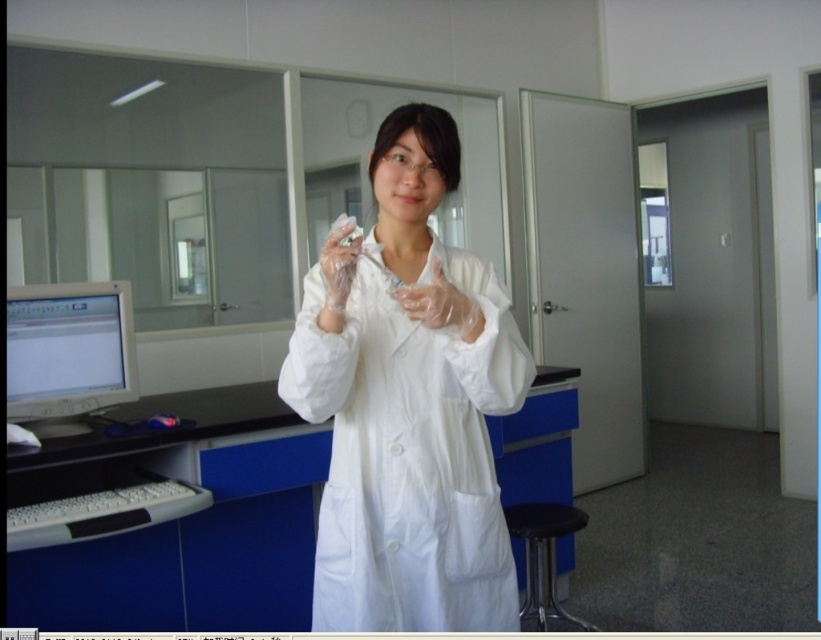
Question: Which point is closer to the camera taking this photo?

Choices:
 (A) (549, 561)
 (B) (324, 339)
 (C) (433, 282)

Answer: (B)

Question: Can you confirm if white lab coat at center is positioned to the left of clear plastic glove at center?

Choices:
 (A) yes
 (B) no

Answer: (A)

Question: Which point is closer to the camera?

Choices:
 (A) clear plastic glove at center
 (B) matte gray monitor at left
 (C) black plastic stool at lower right
 (D) white lab coat at center

Answer: (D)

Question: Can you confirm if white lab coat at center is smaller than black plastic stool at lower right?

Choices:
 (A) no
 (B) yes

Answer: (A)

Question: Does matte gray monitor at left have a lesser width compared to clear plastic glove at center?

Choices:
 (A) yes
 (B) no

Answer: (B)

Question: Which is farther from the white lab coat at center?

Choices:
 (A) matte gray monitor at left
 (B) clear plastic glove at center

Answer: (A)